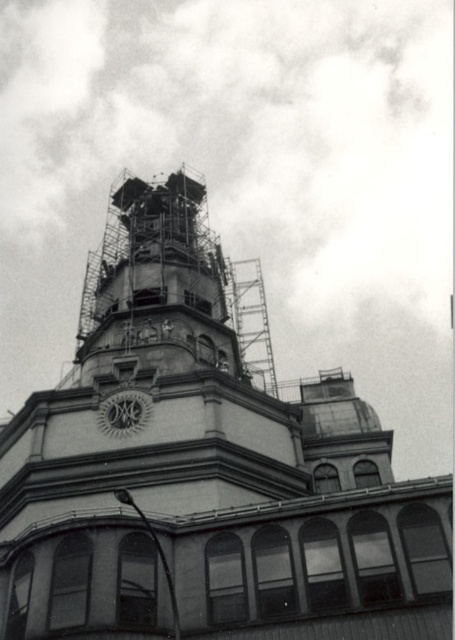
Based on the photo, you are an architect inspecting the construction site. You notice the stone scaffolding at center and the white textured clock at center. Which object is positioned higher in the image?

The stone scaffolding at center is above the white textured clock at center, so it is positioned higher.

You are an architect examining the construction site. You notice the stone scaffolding at center and the white textured clock at center. Which object is positioned in front of the other?

The stone scaffolding at center is closer to the viewer than the white textured clock at center, so the stone scaffolding at center is positioned in front of the white textured clock at center.

From the picture: You are a construction worker standing at the base of the building. You need to reach the white textured clock at center to adjust its time. The stone scaffolding at center is in your way. Can you safely climb the scaffolding to reach the clock?

The stone scaffolding at center is 15.53 meters from the white textured clock at center. Since the scaffolding is at a distance from the clock, you cannot directly climb it to reach the clock. You would need to find another path or equipment to access the clock.